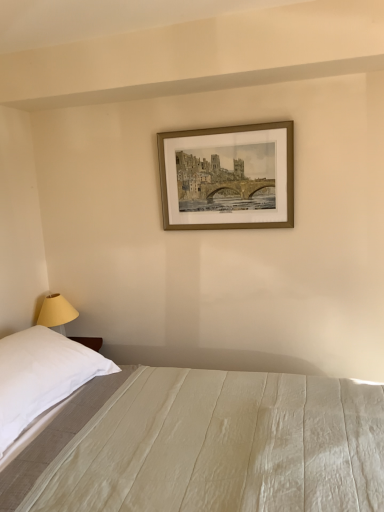
Question: From a real-world perspective, does white soft pillow at left sit lower than gold metallic picture frame at upper center?

Choices:
 (A) no
 (B) yes

Answer: (B)

Question: Is white soft pillow at left shorter than gold metallic picture frame at upper center?

Choices:
 (A) no
 (B) yes

Answer: (B)

Question: Is white soft pillow at left positioned in front of gold metallic picture frame at upper center?

Choices:
 (A) yes
 (B) no

Answer: (A)

Question: Is white soft pillow at left not inside gold metallic picture frame at upper center?

Choices:
 (A) no
 (B) yes

Answer: (B)

Question: Is white soft pillow at left to the right of gold metallic picture frame at upper center from the viewer's perspective?

Choices:
 (A) yes
 (B) no

Answer: (B)

Question: Is white soft pillow at left smaller than gold metallic picture frame at upper center?

Choices:
 (A) yes
 (B) no

Answer: (B)

Question: Is white cotton bed at lower center at the right side of white soft pillow at left?

Choices:
 (A) yes
 (B) no

Answer: (A)

Question: Does white cotton bed at lower center have a greater height compared to white soft pillow at left?

Choices:
 (A) yes
 (B) no

Answer: (A)

Question: Does white cotton bed at lower center have a lesser height compared to white soft pillow at left?

Choices:
 (A) no
 (B) yes

Answer: (A)

Question: Does white cotton bed at lower center have a lesser width compared to white soft pillow at left?

Choices:
 (A) yes
 (B) no

Answer: (B)

Question: Is white cotton bed at lower center further to camera compared to white soft pillow at left?

Choices:
 (A) yes
 (B) no

Answer: (B)

Question: Is white cotton bed at lower center closer to the viewer compared to white soft pillow at left?

Choices:
 (A) yes
 (B) no

Answer: (A)

Question: Is the position of white cotton bed at lower center more distant than that of gold metallic picture frame at upper center?

Choices:
 (A) no
 (B) yes

Answer: (A)